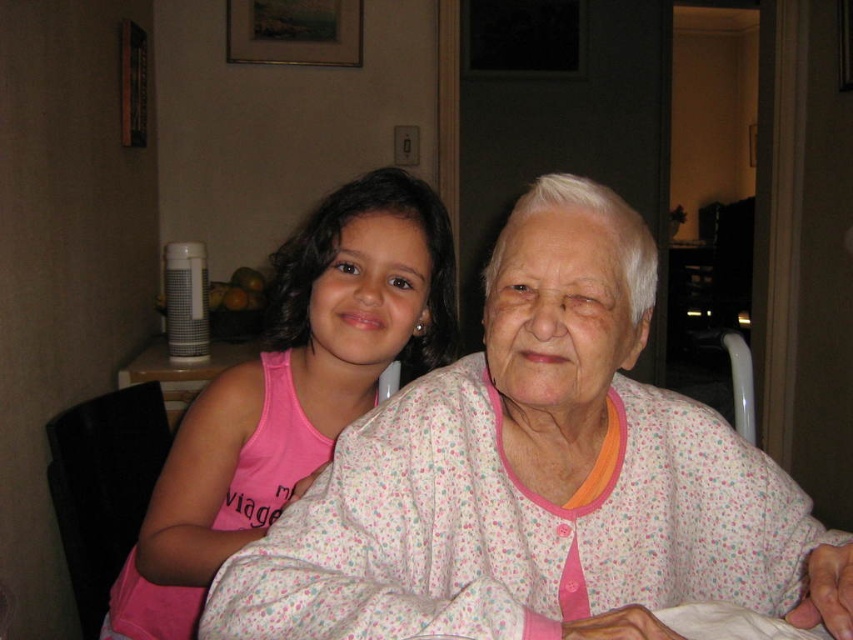
Is floral cotton pajamas at center bigger than pink fabric at center?

Incorrect, floral cotton pajamas at center is not larger than pink fabric at center.

Is point (294, 541) closer to camera compared to point (268, 460)?

Yes, it is.

Identify the location of floral cotton pajamas at center. (538, 477).

Where is `floral cotton pajamas at center`? The image size is (853, 640). floral cotton pajamas at center is located at coordinates (538, 477).